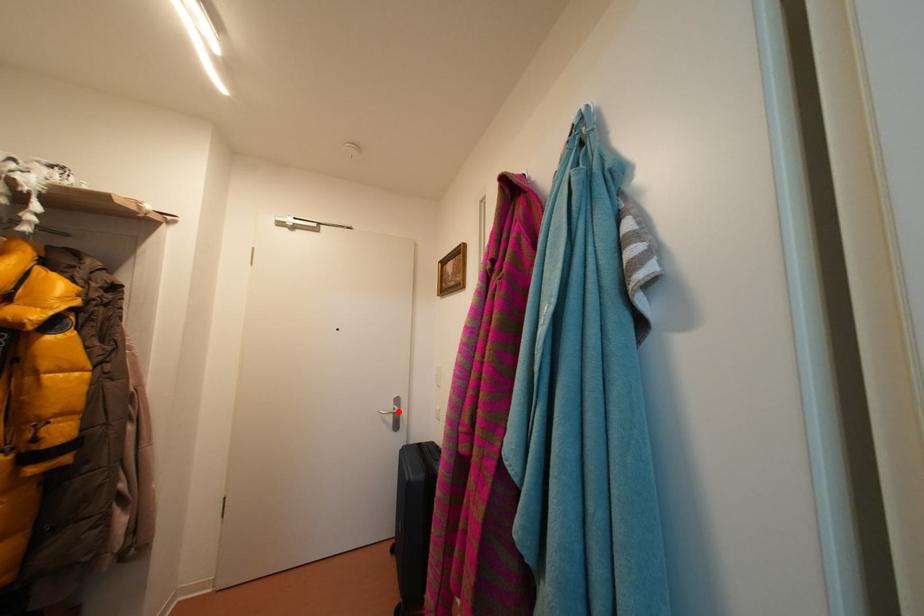
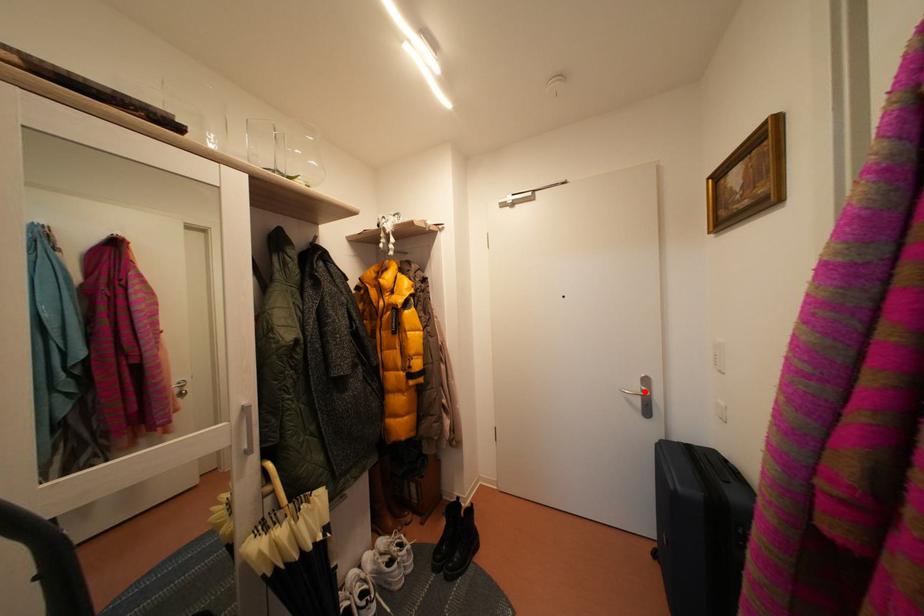
I am providing you with two images of the same scene from different viewpoints. A red point is marked on the first image and another point is marked on the second image. Is the red point in image1 aligned with the point shown in image2?

Yes